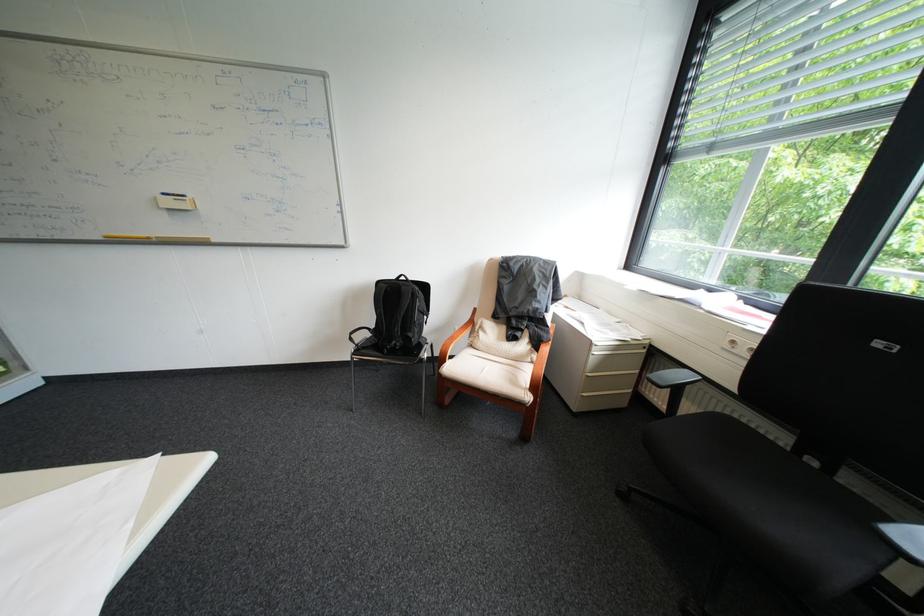
This screenshot has height=616, width=924. In order to click on backpack handle in this screenshot , I will do `click(397, 317)`.